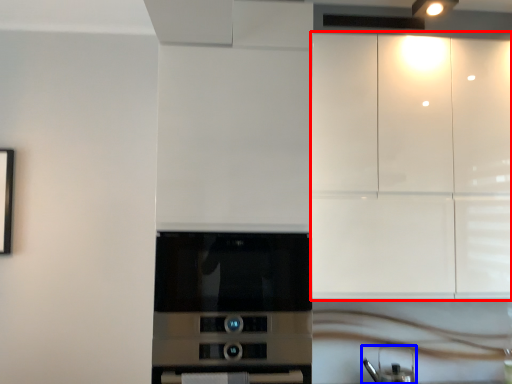
Question: Which object appears closest to the camera in this image, cabinetry (highlighted by a red box) or appliance (highlighted by a blue box)?

Choices:
 (A) cabinetry
 (B) appliance

Answer: (A)